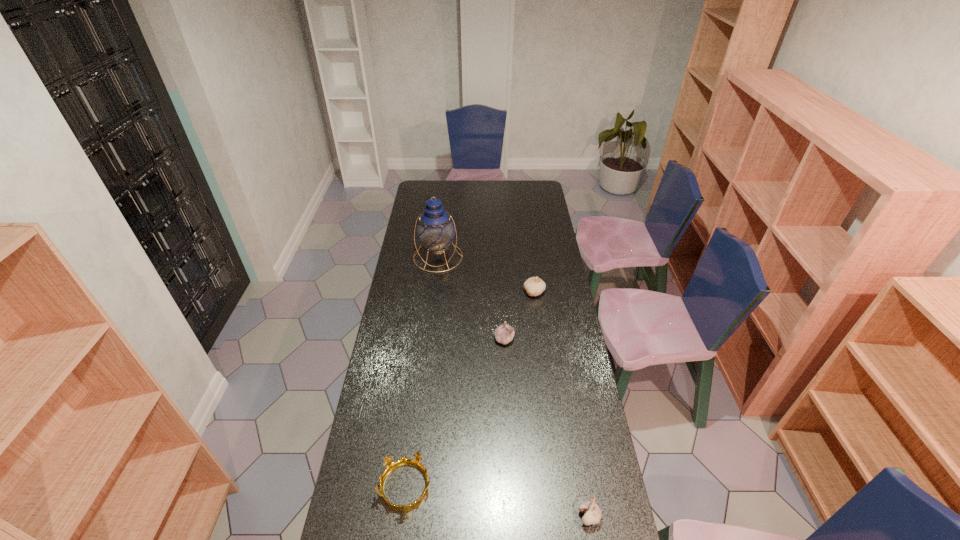
Image resolution: width=960 pixels, height=540 pixels. Identify the location of vacant space that's between the crown and the fourth nearest object. (470, 389).

In order to click on vacant region between the shortest object and the second farthest garlic in this screenshot , I will do point(455,413).

Identify the location of empty space between the tallest object and the third object from right to left. (471, 298).

The image size is (960, 540). In order to click on empty space between the lantern and the crown in this screenshot , I will do `click(421, 372)`.

This screenshot has width=960, height=540. What are the coordinates of `free point between the leftmost garlic and the farthest object` in the screenshot? It's located at (471, 298).

Where is `free space between the nearest garlic and the third nearest object`? free space between the nearest garlic and the third nearest object is located at coordinates (546, 428).

What are the coordinates of `free point between the shortest garlic and the fourth nearest object` in the screenshot? It's located at (562, 404).

Image resolution: width=960 pixels, height=540 pixels. Identify the location of free spot between the third object from right to left and the farthest object. (471, 298).

The height and width of the screenshot is (540, 960). Identify the location of blank region between the farthest object and the second shortest object. (514, 387).

Point out which object is positioned as the fourth nearest to the nearest garlic. Please provide its 2D coordinates. Your answer should be formatted as a tuple, i.e. [(x, y)], where the tuple contains the x and y coordinates of a point satisfying the conditions above.

[(435, 229)]